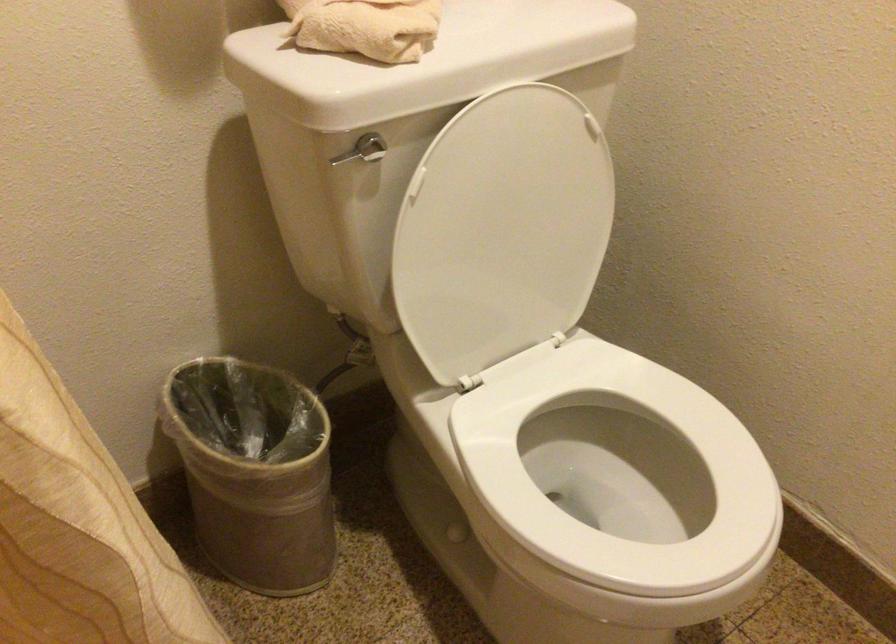
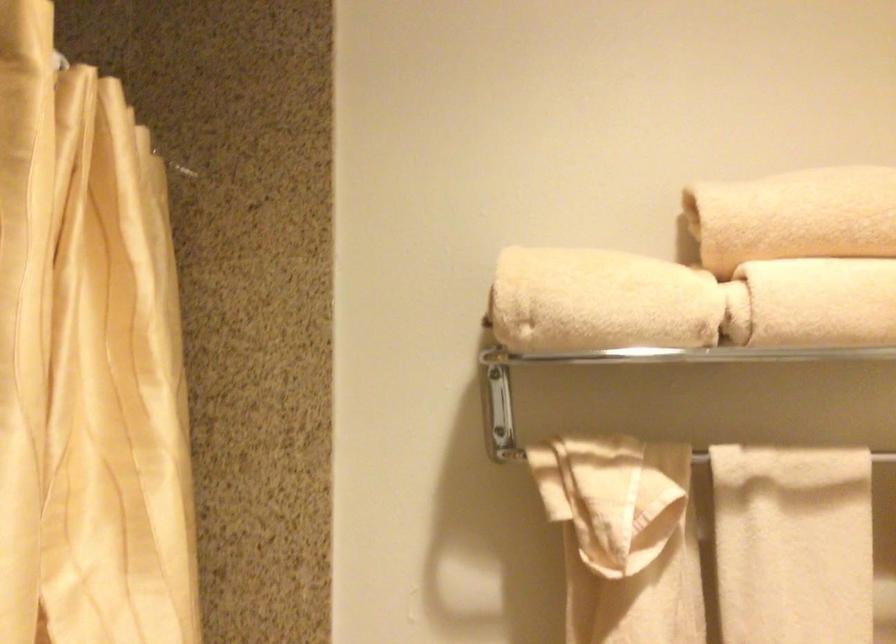
The images are taken continuously from a first-person perspective. In which direction is your viewpoint rotating?

The rotation direction of the camera is left-up.